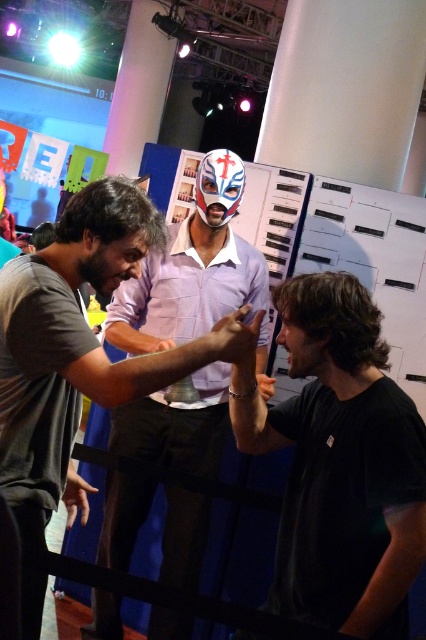
You are a photographer at the event and want to capture a photo of both the black matte shirt at center and the white matte mask at center. Which object should you focus on first if you want to include both in the frame without moving the camera?

The black matte shirt at center is positioned on the right side of white matte mask at center, so you should focus on the white matte mask at center first to ensure both are in frame.

You are an event organizer standing at the back of the stage. You need to ensure that the black matte shirt at center and the white matte mask at center are visible to the audience. Based on their heights, which one is more likely to be obscured by the other?

The black matte shirt at center has a lesser height compared to white matte mask at center, so the black matte shirt at center is more likely to be obscured by the white matte mask at center.